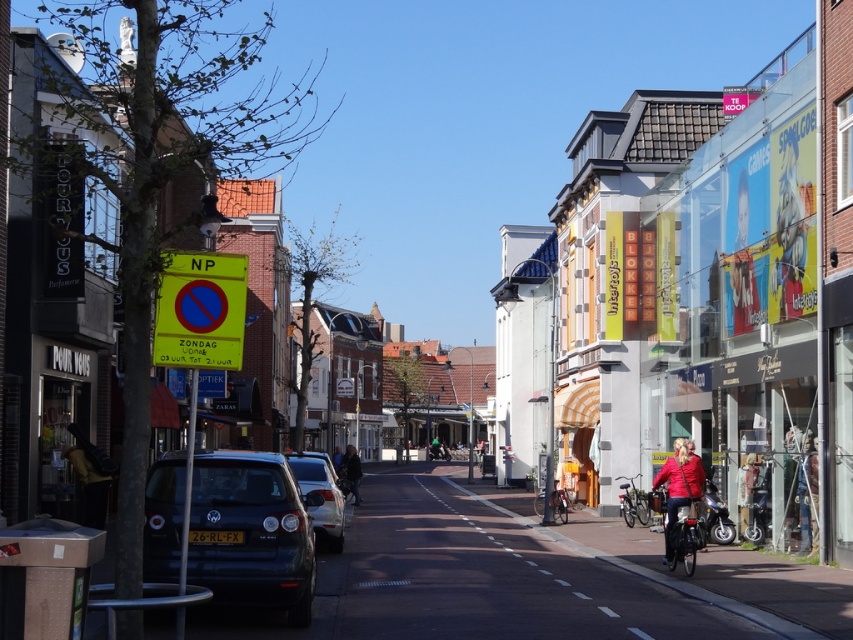
Is point (335, 516) closer to viewer compared to point (703, 518)?

Yes, it is.

Which is below, silver metallic car at center or shiny black motorcycle at center-right?

shiny black motorcycle at center-right is lower down.

This screenshot has width=853, height=640. I want to click on silver metallic car at center, so click(x=321, y=497).

Looking at this image, is silver metallic car at center bigger than dark blue jacket at center?

No.

Is point (329, 545) farther from camera compared to point (341, 472)?

No, it is in front of (341, 472).

The image size is (853, 640). What are the coordinates of `silver metallic car at center` in the screenshot? It's located at (321, 497).

Can you confirm if silver metallic bicycle at center-right is smaller than dark blue jacket at center?

Yes.

Locate an element on the screen. This screenshot has height=640, width=853. silver metallic bicycle at center-right is located at coordinates (633, 502).

Measure the distance between silver metallic bicycle at center-right and camera.

silver metallic bicycle at center-right and camera are 88.08 feet apart from each other.

This screenshot has width=853, height=640. What are the coordinates of `silver metallic bicycle at center-right` in the screenshot? It's located at (633, 502).